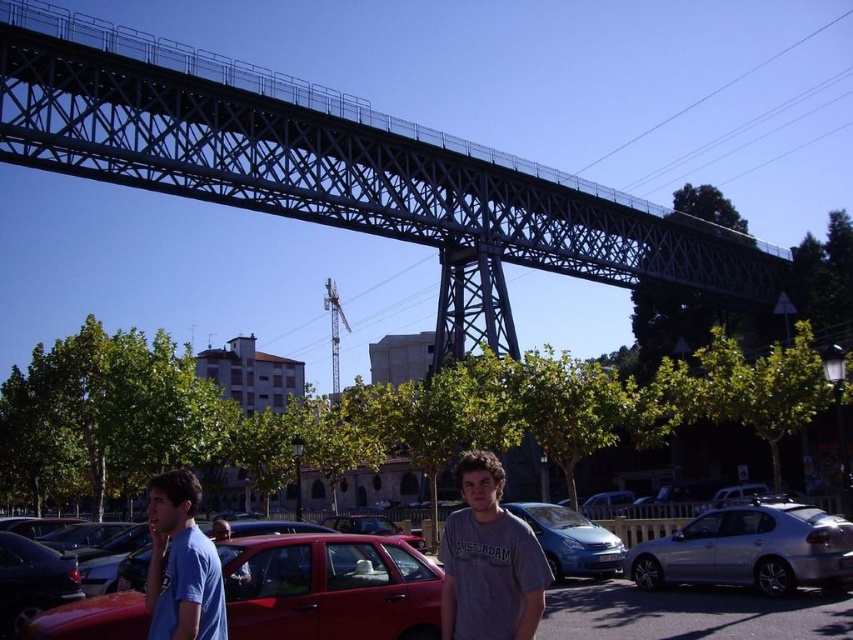
You are standing at the base of the bridge and see a blue cotton shirt at lower left and a matte blue van at center. Which object is farther away from you?

The blue cotton shirt at lower left is 112.93 feet away from the matte blue van at center, so the blue cotton shirt at lower left is farther away from you.

You are a photographer planning to take a photo of the blue cotton shirt at lower left and the matte blue van at center. Since you want both subjects to appear equally prominent in the photo, which one should you zoom in on more?

The blue cotton shirt at lower left has a smaller size compared to matte blue van at center, so you should zoom in more on the blue cotton shirt at lower left to make it appear larger and balance its prominence with the matte blue van at center in the photo.

You are a delivery driver who needs to park your truck, which is 2 meters wide, in this parking lot. You observe the silver metallic car at lower right and the matte blue van at center. Which vehicle has a wider body, and can your truck fit in the space where the wider vehicle is parked?

The silver metallic car at lower right is wider than the matte blue van at center. Since your truck is 2 meters wide and the silver metallic car at lower right is wider, the truck can fit in that space as long as the width of the parking space accommodates the car, which it likely does since the car is already parked there.